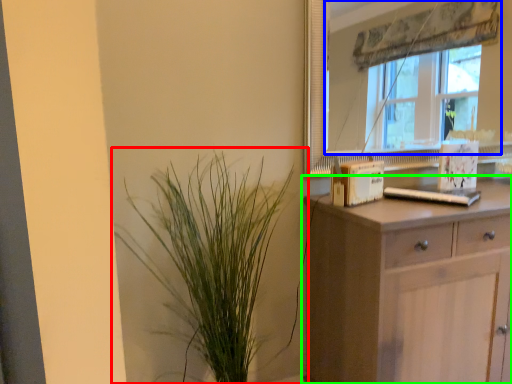
Question: Based on their relative distances, which object is nearer to houseplant (highlighted by a red box)? Choose from window (highlighted by a blue box) and chest of drawers (highlighted by a green box).

Choices:
 (A) window
 (B) chest of drawers

Answer: (B)